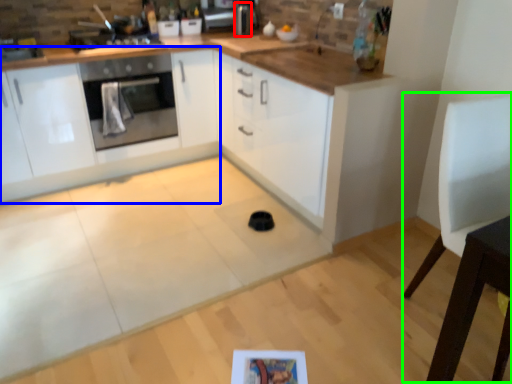
Question: Estimate the real-world distances between objects in this image. Which object is farther from appliance (highlighted by a red box), cabinetry (highlighted by a blue box) or chair (highlighted by a green box)?

Choices:
 (A) cabinetry
 (B) chair

Answer: (B)